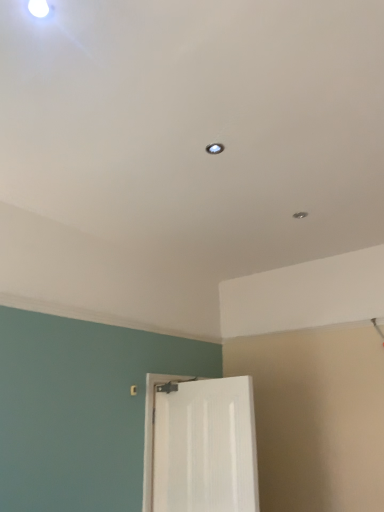
Describe the element at coordinates (200, 445) in the screenshot. I see `white glossy door at lower center` at that location.

Locate an element on the screen. This screenshot has width=384, height=512. white glossy door at lower center is located at coordinates (200, 445).

Locate an element on the screen. This screenshot has height=512, width=384. white glossy door at lower center is located at coordinates (200, 445).